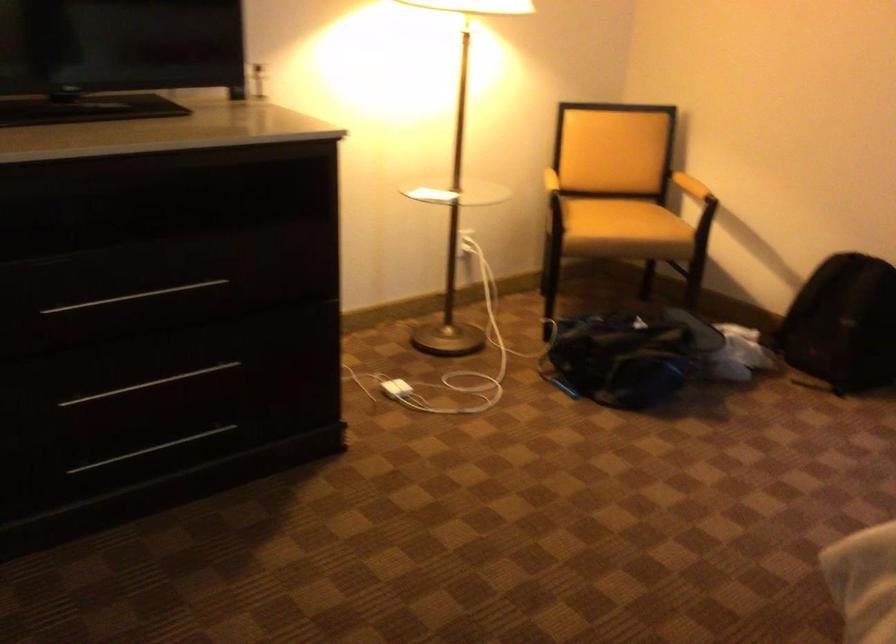
I want to click on blue duffel bag, so click(x=627, y=355).